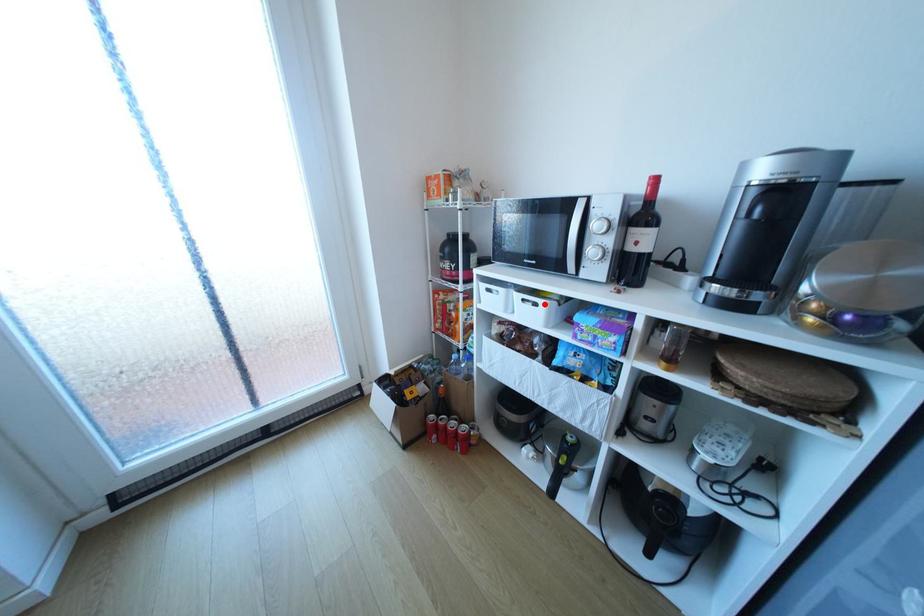
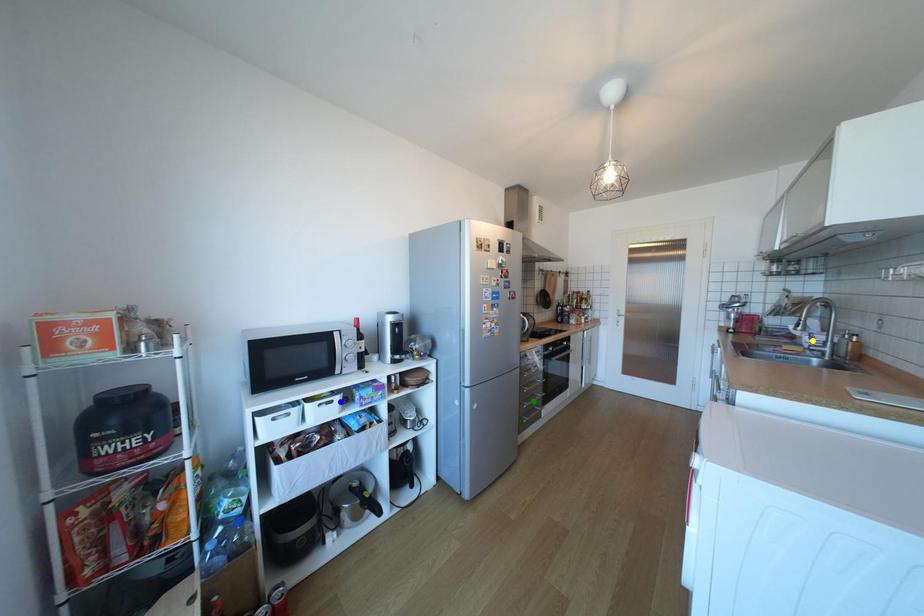
Question: I am providing you with two images of the same scene from different viewpoints. A red point is marked on the first image. You are given multiple points on the second image. Which point in image 2 represents the same 3d spot as the red point in image 1?

Choices:
 (A) yellow point
 (B) green point
 (C) blue point

Answer: (C)